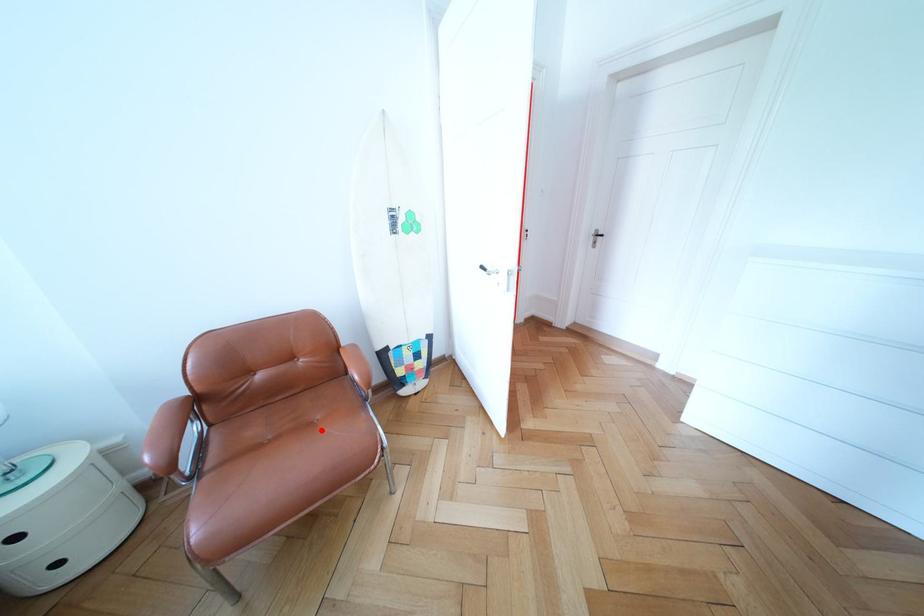
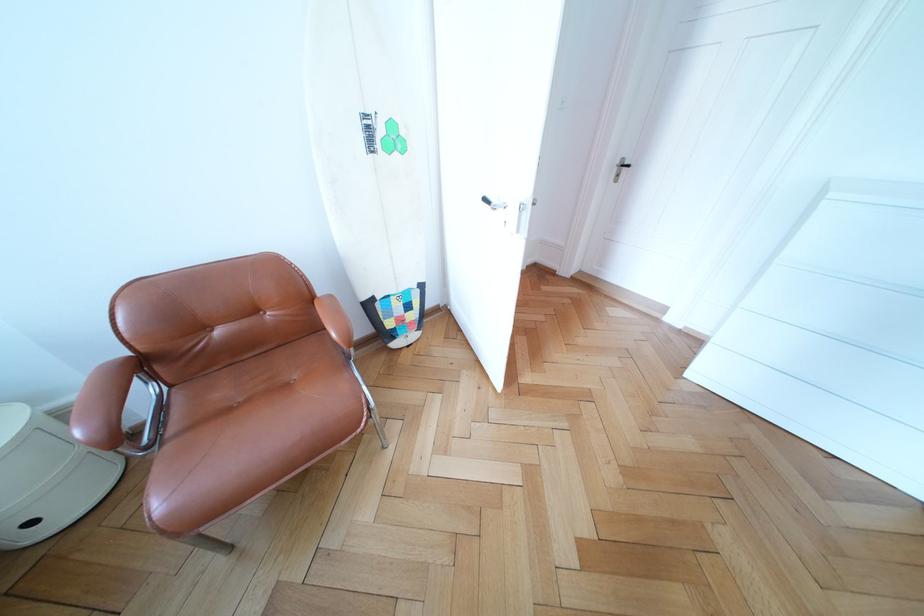
Where in the second image is the point corresponding to the highlighted location from the first image?

(298, 391)